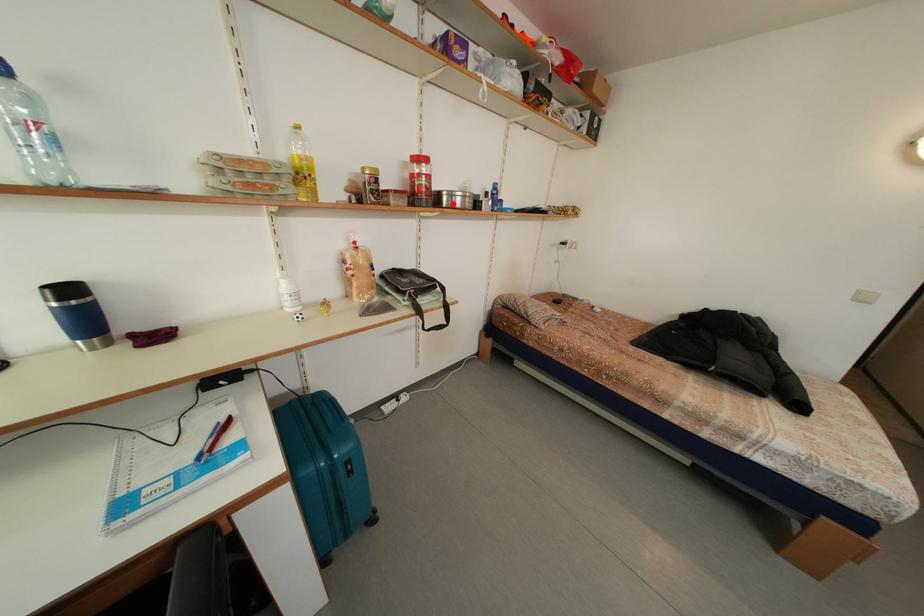
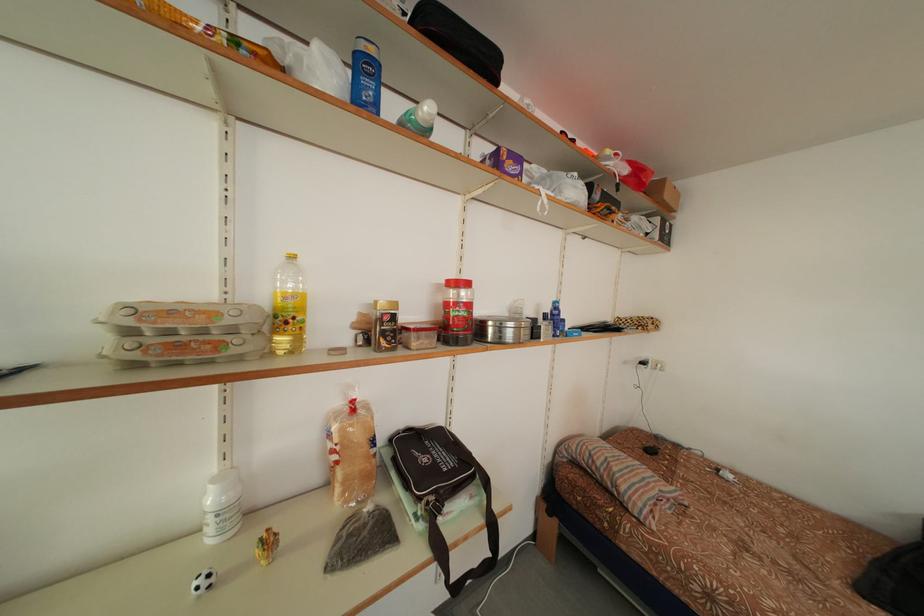
Where in the second image is the point corresponding to the highlighted location from the first image?

(499, 334)